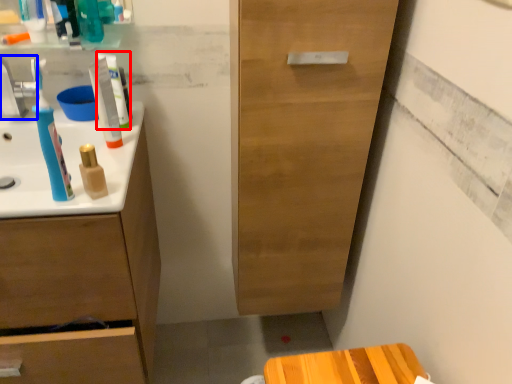
Question: Which of the following is the farthest to the observer, toothpaste (highlighted by a red box) or faucet (highlighted by a blue box)?

Choices:
 (A) toothpaste
 (B) faucet

Answer: (A)